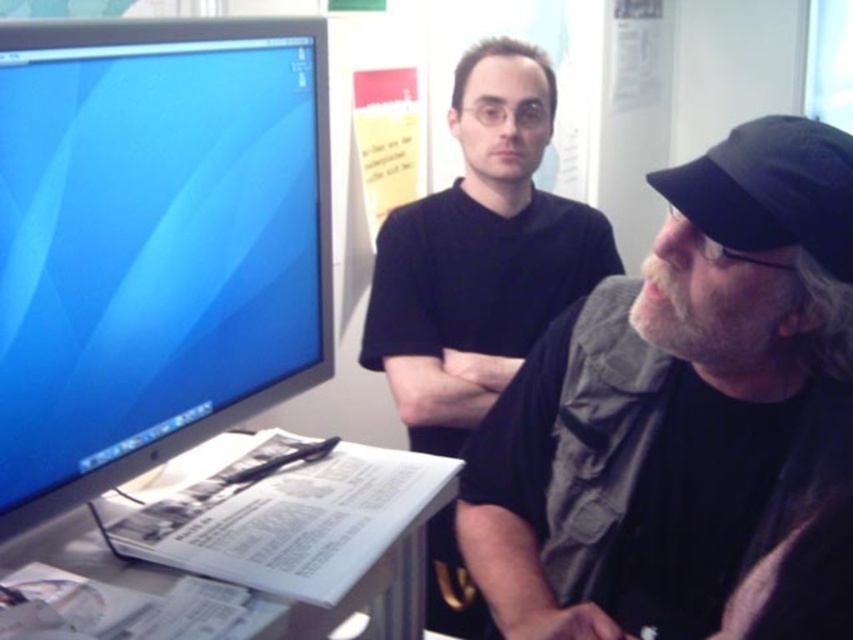
You are standing in the office and want to move from the point at coordinates (703, 285) to the point at (113, 573). Which direction should you move relative to the other point?

You should move towards the direction of point (113, 573), which is behind point (703, 285) based on their spatial relationship.

You are trying to place a rectangular object on the desk. The black matte shirt at center and the white paper at lower center are already there. Which object has a wider surface area for placing your item?

The black matte shirt at center has a larger width than the white paper at lower center, so it offers a wider surface area for placing your item.

You are a delivery person who needs to place a package between the dark gray fabric shirt at center and the matte plastic monitor at left. Can the package fit horizontally between them if the package is 1.2 meters wide?

The dark gray fabric shirt at center is wider than the matte plastic monitor at left. Since the package is 1.2 meters wide, it depends on the combined width of both objects. However, the description only states the shirt is wider, not the total space between them. Without knowing the exact distance between the shirt and the monitor, we cannot determine if the package will fit.